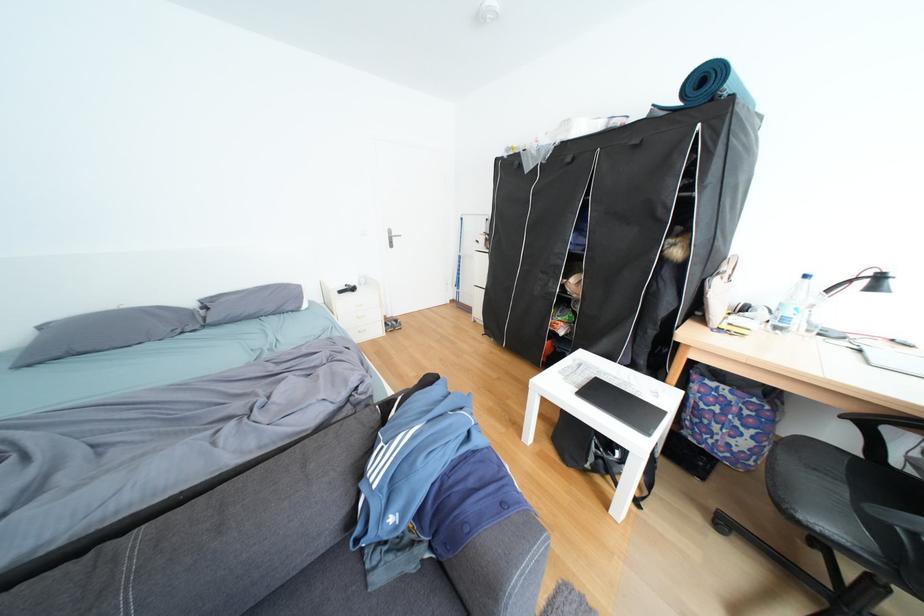
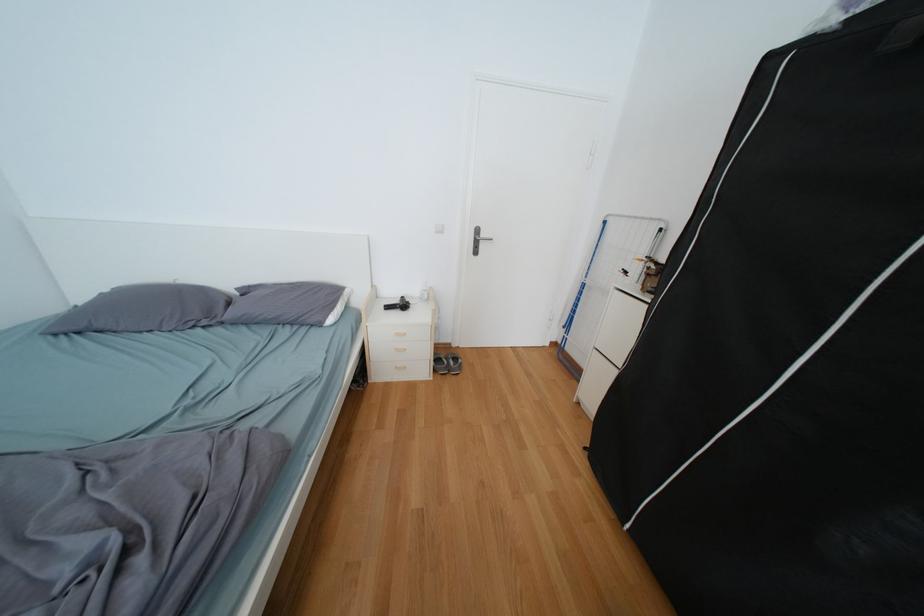
Locate, in the second image, the point that corresponds to pixel 217 328 in the first image.

(235, 323)